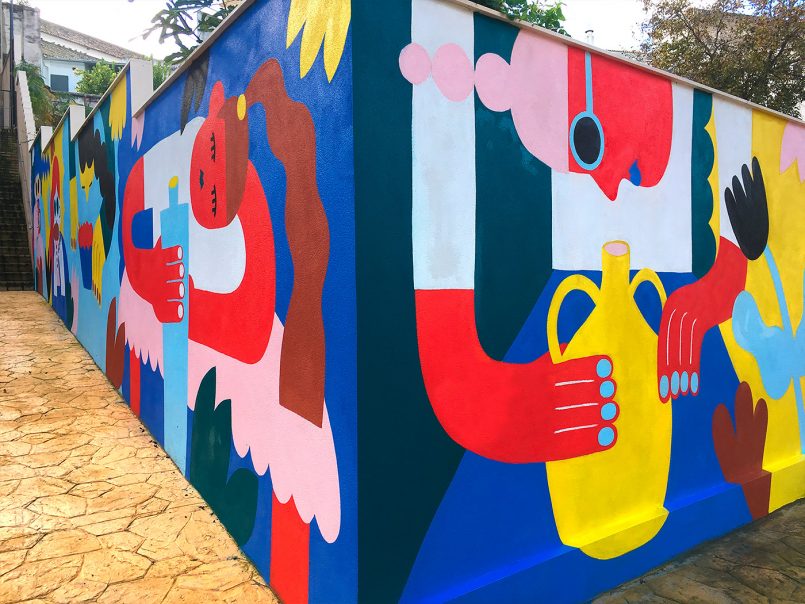
Locate an element on the screen. Image resolution: width=805 pixels, height=604 pixels. painting of head is located at coordinates (632, 111).